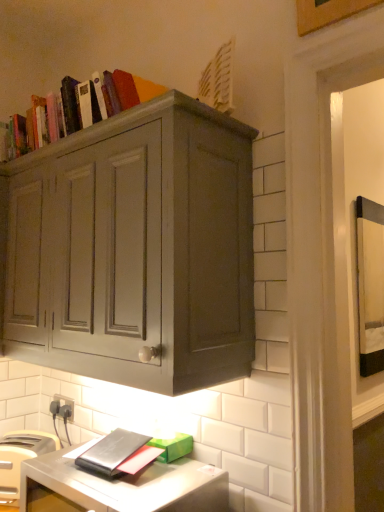
Question: From the image's perspective, is wooden picture frame at upper right located above or below matte gray cabinet at upper center?

Choices:
 (A) below
 (B) above

Answer: (B)

Question: Is point (339, 3) closer or farther from the camera than point (155, 147)?

Choices:
 (A) closer
 (B) farther

Answer: (B)

Question: Which object is positioned farthest from the white plastic toaster at lower left?

Choices:
 (A) wooden picture frame at upper right
 (B) matte gray cabinet at upper center
 (C) black plastic electric outlet at lower left
 (D) metallic silver computer desk at lower left

Answer: (A)

Question: Which of these objects is positioned closest to the white plastic toaster at lower left?

Choices:
 (A) metallic silver computer desk at lower left
 (B) matte gray cabinet at upper center
 (C) wooden picture frame at upper right
 (D) black plastic electric outlet at lower left

Answer: (A)